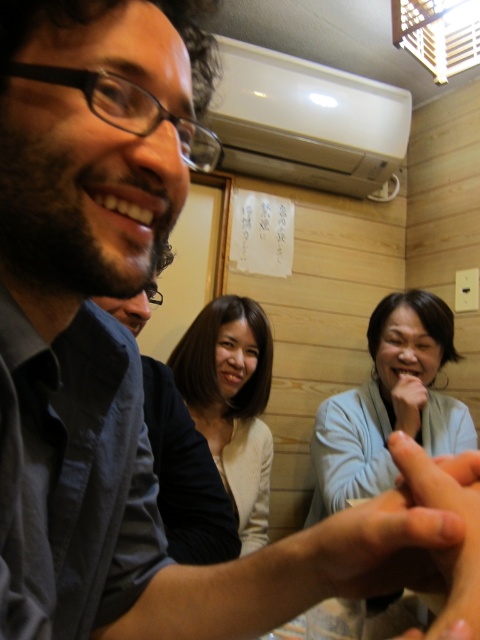
Question: Can you confirm if light blue fabric at center is positioned to the right of smooth skin hand at center?

Choices:
 (A) no
 (B) yes

Answer: (B)

Question: Can you confirm if smooth beige blouse at center is smaller than smooth skin hand at center?

Choices:
 (A) no
 (B) yes

Answer: (A)

Question: Which point is closer to the camera?

Choices:
 (A) 393,497
 (B) 331,481
 (C) 195,328

Answer: (A)

Question: Which object is positioned farthest from the smooth skin hand at center?

Choices:
 (A) smooth beige blouse at center
 (B) light blue fabric at center

Answer: (B)

Question: Estimate the real-world distances between objects in this image. Which object is farther from the smooth skin hand at center?

Choices:
 (A) light blue fabric at center
 (B) smooth beige blouse at center

Answer: (A)

Question: Does light blue fabric at center appear under smooth beige blouse at center?

Choices:
 (A) no
 (B) yes

Answer: (B)